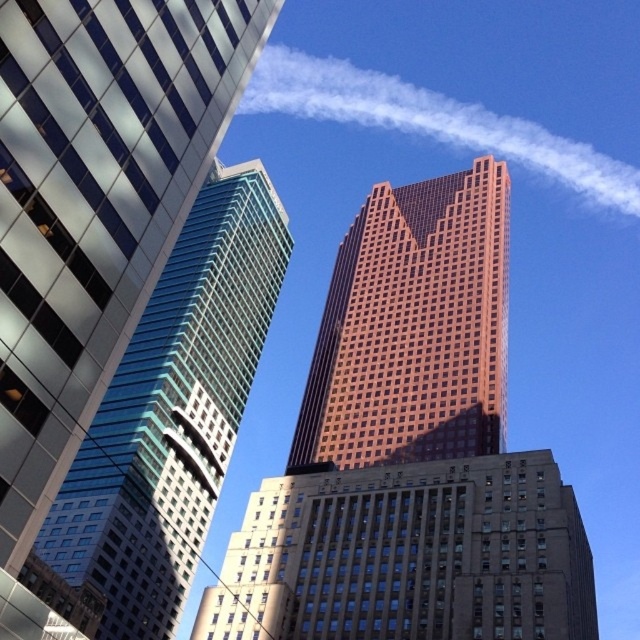
You are a drone operator who needs to fly a drone from the brown brick building at center to the white vapor at upper center. What is the approximate distance you need to cover in meters?

The distance between the brown brick building at center and the white vapor at upper center is 287.41 meters, so the drone needs to cover approximately 287.41 meters.